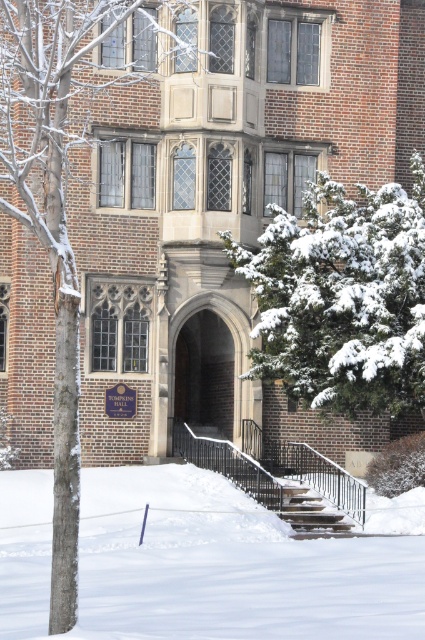
Is white fluffy snow at lower center shorter than metallic gray staircase at center?

No.

Who is positioned more to the left, white fluffy snow at lower center or metallic gray staircase at center?

Positioned to the left is white fluffy snow at lower center.

What do you see at coordinates (231, 566) in the screenshot? This screenshot has width=425, height=640. I see `white fluffy snow at lower center` at bounding box center [231, 566].

The height and width of the screenshot is (640, 425). In order to click on white fluffy snow at lower center in this screenshot , I will do `click(231, 566)`.

Is point (359, 284) behind point (62, 468)?

Yes, it is behind point (62, 468).

Which is behind, point (322, 392) or point (59, 550)?

Point (322, 392)

At what (x,y) coordinates should I click in order to perform the action: click on snow-covered evergreen tree at center. Please return your answer as a coordinate pair (x, y). The image size is (425, 640). Looking at the image, I should click on (342, 298).

Is point (374, 214) positioned in front of point (333, 522)?

No, it is not.

Between snow-covered evergreen tree at center and metallic gray staircase at center, which one is positioned lower?

metallic gray staircase at center is below.

Between point (343, 332) and point (337, 524), which one is positioned behind?

Point (343, 332)

At what (x,y) coordinates should I click in order to perform the action: click on snow-covered evergreen tree at center. Please return your answer as a coordinate pair (x, y). Looking at the image, I should click on (342, 298).